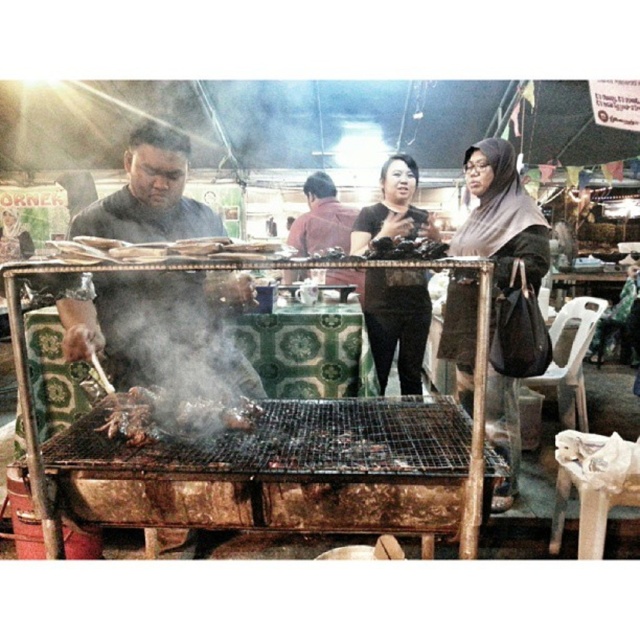
You are a customer waiting in line to order food at the street stall. You notice two people in front of you wearing a matte black shirt at center and a dark red shirt at center. Which customer should you look behind to see the grill?

The matte black shirt at center is in front of dark red shirt at center, so you should look behind the matte black shirt at center to see the grill.

You are a food vendor at the market and need to place a 15 inch wide tray between the brown fabric hijab at center and the matte black shirt at center. Can the tray fit between them?

The brown fabric hijab at center is 20.21 inches from matte black shirt at center, so yes, the 15 inch wide tray can fit between them since the distance is greater than the tray width.